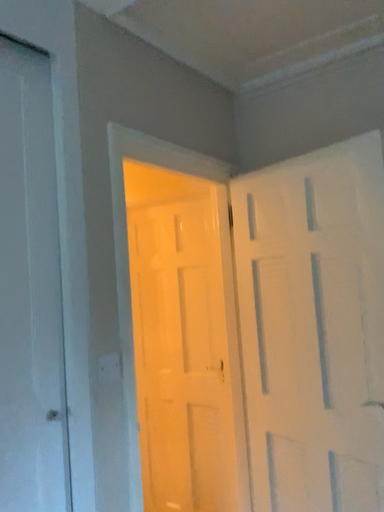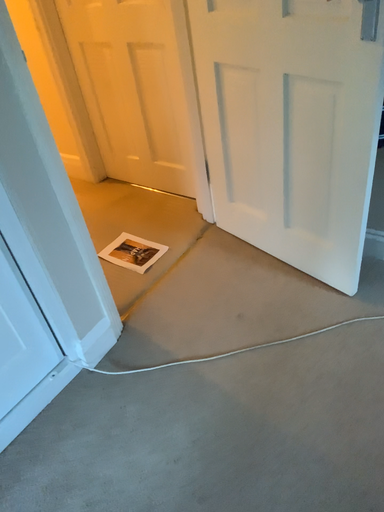
Question: Which way did the camera rotate in the video?

Choices:
 (A) rotated downward
 (B) rotated upward

Answer: (A)